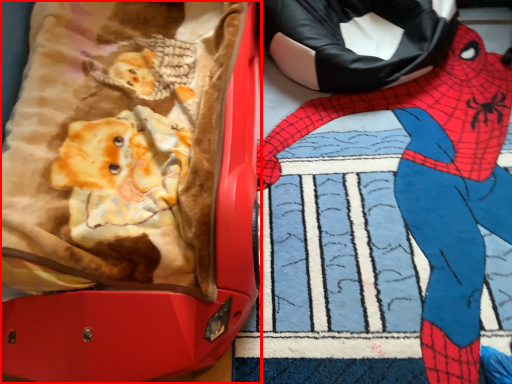
Question: From the image's perspective, considering the relative positions of suitcase (annotated by the red box) and person in the image provided, where is suitcase (annotated by the red box) located with respect to the staircase?

Choices:
 (A) below
 (B) above

Answer: (B)